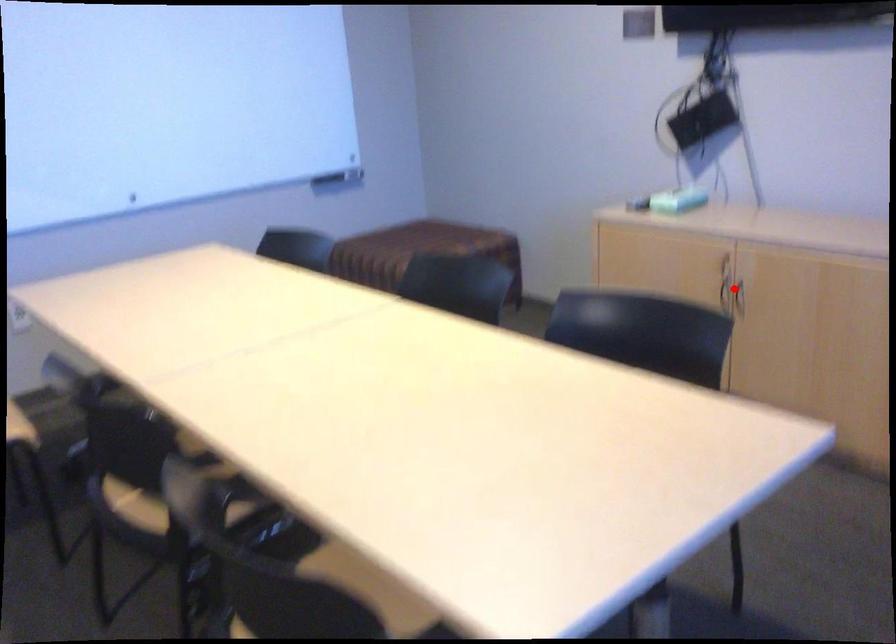
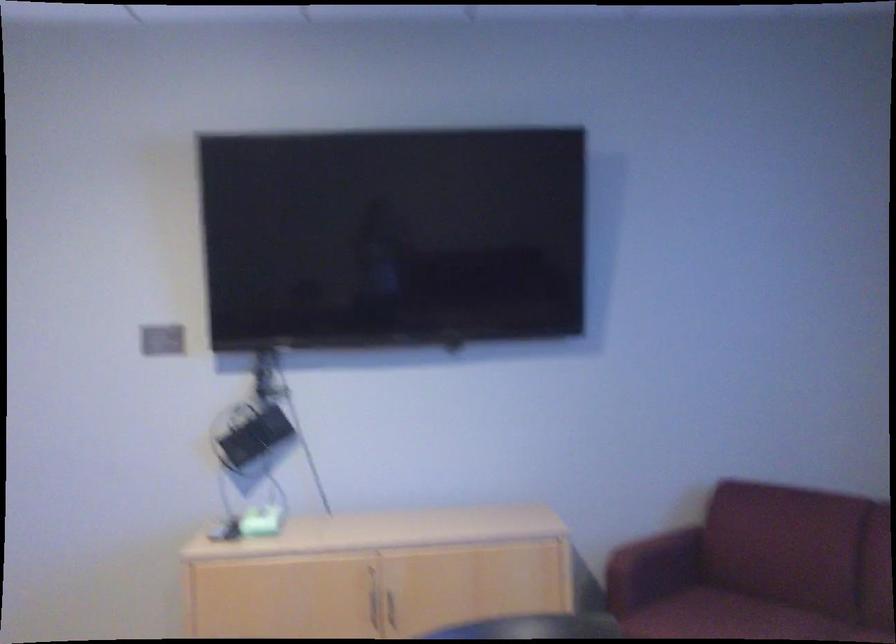
Locate, in the second image, the point that corresponds to the highlighted location in the first image.

(374, 607)